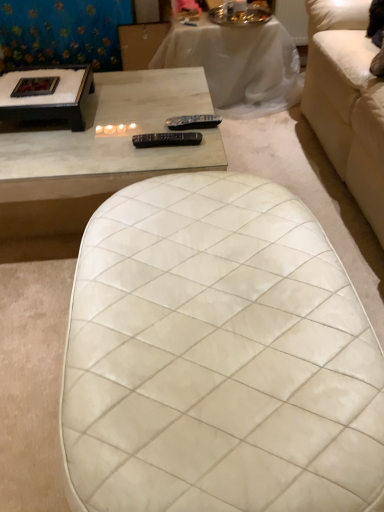
You are a GUI agent. You are given a task and a screenshot of the screen. Output one action in this format:
    pyautogui.click(x=<x>, y=<y>)
    Task: Click on the unoccupied region to the right of black plastic remote at center, which ranks as the first remote in bottom-to-top order
    
    Given the screenshot: What is the action you would take?
    pyautogui.click(x=202, y=147)